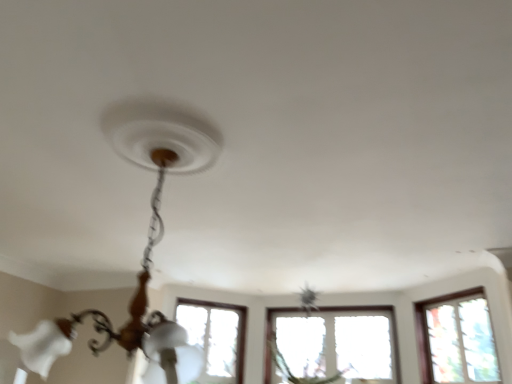
In order to click on clear glass window at right in this screenshot , I will do `click(456, 339)`.

The image size is (512, 384). What do you see at coordinates (456, 339) in the screenshot? I see `clear glass window at right` at bounding box center [456, 339].

Measure the distance between matte white chandelier at center and camera.

4.18 feet.

Where is `matte white chandelier at center`? This screenshot has width=512, height=384. matte white chandelier at center is located at coordinates (148, 233).

Describe the element at coordinates (148, 233) in the screenshot. I see `matte white chandelier at center` at that location.

At what (x,y) coordinates should I click in order to perform the action: click on clear glass window at right. Please return your answer as a coordinate pair (x, y). This screenshot has width=512, height=384. Looking at the image, I should click on (456, 339).

Which is more to the left, matte white chandelier at center or clear glass window at right?

From the viewer's perspective, matte white chandelier at center appears more on the left side.

Does matte white chandelier at center lie behind clear glass window at right?

No.

Does point (93, 340) lie in front of point (424, 338)?

Yes.

From the picture: From the image's perspective, does matte white chandelier at center appear lower than clear glass window at right?

Incorrect, from the image's perspective, matte white chandelier at center is higher than clear glass window at right.

From a real-world perspective, is matte white chandelier at center positioned over clear glass window at right based on gravity?

Incorrect, from a real-world perspective, matte white chandelier at center is lower than clear glass window at right.

Between matte white chandelier at center and clear glass window at right, which one has smaller width?

With smaller width is clear glass window at right.

Looking at this image, between matte white chandelier at center and clear glass window at right, which one has more height?

matte white chandelier at center.

Considering the relative sizes of matte white chandelier at center and clear glass window at right in the image provided, is matte white chandelier at center smaller than clear glass window at right?

Actually, matte white chandelier at center might be larger than clear glass window at right.

Is matte white chandelier at center not within clear glass window at right?

Yes, matte white chandelier at center is located beyond the bounds of clear glass window at right.

Is matte white chandelier at center next to clear glass window at right and touching it?

matte white chandelier at center and clear glass window at right are clearly separated.

Is matte white chandelier at center facing away from clear glass window at right?

No, matte white chandelier at center is not facing the opposite direction of clear glass window at right.

I want to click on window on the right of the matte white chandelier at center, so click(x=456, y=339).

Is clear glass window at right to the left of matte white chandelier at center from the viewer's perspective?

Incorrect, clear glass window at right is not on the left side of matte white chandelier at center.

Considering the positions of objects clear glass window at right and matte white chandelier at center in the image provided, who is behind, clear glass window at right or matte white chandelier at center?

Positioned behind is clear glass window at right.

Which point is more distant from viewer, (462, 304) or (157, 334)?

The point (462, 304) is farther from the camera.

From the image's perspective, between clear glass window at right and matte white chandelier at center, which one is located above?

From the image's view, matte white chandelier at center is above.

From a real-world perspective, which object stands above the other?

In real-world perspective, clear glass window at right is above.

In terms of width, does clear glass window at right look wider or thinner when compared to matte white chandelier at center?

Considering their sizes, clear glass window at right looks slimmer than matte white chandelier at center.

In terms of height, does clear glass window at right look taller or shorter compared to matte white chandelier at center?

Clearly, clear glass window at right is shorter compared to matte white chandelier at center.

Does clear glass window at right have a smaller size compared to matte white chandelier at center?

Correct, clear glass window at right occupies less space than matte white chandelier at center.

Would you say clear glass window at right is inside or outside matte white chandelier at center?

clear glass window at right is not enclosed by matte white chandelier at center.

Is clear glass window at right directly adjacent to matte white chandelier at center?

clear glass window at right is not next to matte white chandelier at center, and they're not touching.

Does clear glass window at right turn towards matte white chandelier at center?

Yes.

Find the location of a particular element. This screenshot has width=512, height=384. window that appears on the right of matte white chandelier at center is located at coordinates (456, 339).

Where is `window that appears on the right of matte white chandelier at center`? This screenshot has height=384, width=512. window that appears on the right of matte white chandelier at center is located at coordinates (456, 339).

There is a matte white chandelier at center. Where is `window above it (from a real-world perspective)`? The height and width of the screenshot is (384, 512). window above it (from a real-world perspective) is located at coordinates coord(456,339).